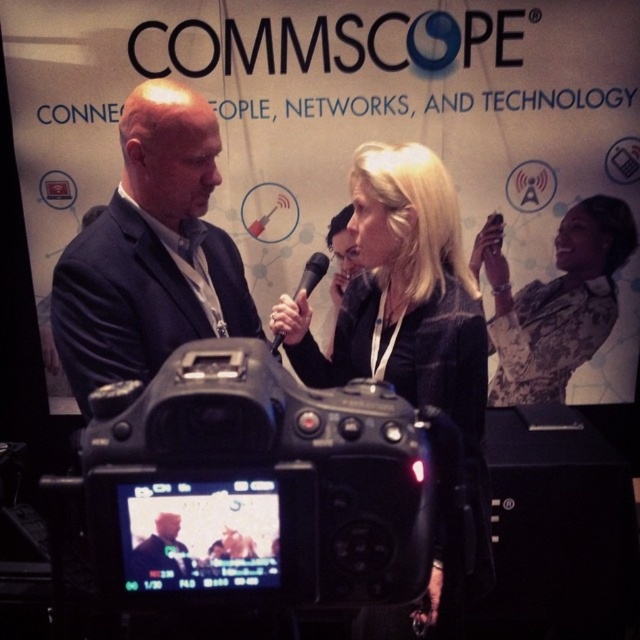
Question: Among these objects, which one is farthest from the camera?

Choices:
 (A) black matte microphone at center
 (B) matte black suit at center
 (C) black plastic/video camera at center

Answer: (A)

Question: Which object appears farthest from the camera in this image?

Choices:
 (A) black matte microphone at center
 (B) dark blue suit at center
 (C) black fabric jacket at center

Answer: (B)

Question: Does black plastic/video camera at center appear on the left side of dark blue suit at center?

Choices:
 (A) yes
 (B) no

Answer: (B)

Question: Is black plastic/video camera at center thinner than matte black suit at center?

Choices:
 (A) yes
 (B) no

Answer: (B)

Question: Can you confirm if black fabric jacket at center is bigger than patterned fabric dress at upper right?

Choices:
 (A) yes
 (B) no

Answer: (A)

Question: Estimate the real-world distances between objects in this image. Which object is farther from the dark blue suit at center?

Choices:
 (A) black matte microphone at center
 (B) black plastic/video camera at center
 (C) black fabric jacket at center

Answer: (B)